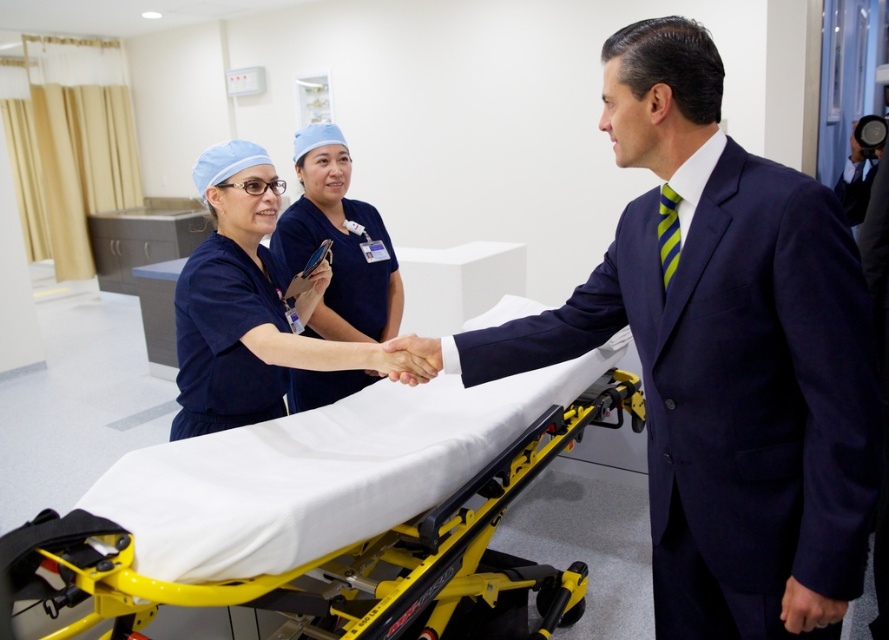
You are a nurse in the hospital and need to determine the clothing width for proper uniform fitting. Which clothing item has a greater width between the navy blue suit at center and the blue scrubs at center?

The navy blue suit at center has a greater width than the blue scrubs at center according to the description.

You are a patient in the hospital and you see two points in the image. The first point is at coordinate point (831, 444) and the second point is at coordinate point (358, 308). Which point is closer to you?

Point (831, 444) is closer to the viewer than point (358, 308).

You are a medical student standing 1.5 meters away from the camera. You need to deliver a document to the navy blue suit at center. Can you reach them without moving closer than your current position?

The navy blue suit at center is 1.06 meters from the camera. Since you are 1.5 meters away from the camera, you are 0.44 meters farther than the target. You can reach them by extending your arm or using a long object.